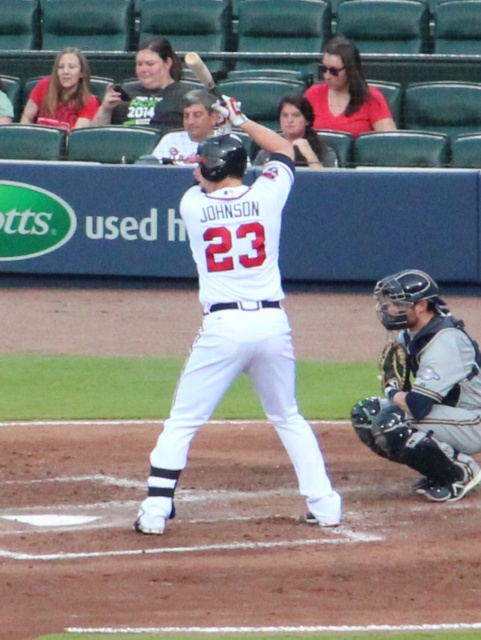
Is point (199, 99) less distant than point (379, 378)?

No.

Which is behind, point (226, 96) or point (390, 356)?

Positioned behind is point (226, 96).

Image resolution: width=481 pixels, height=640 pixels. Describe the element at coordinates (191, 128) in the screenshot. I see `smooth skin face at upper center` at that location.

Where is `smooth skin face at upper center`? The height and width of the screenshot is (640, 481). smooth skin face at upper center is located at coordinates (191, 128).

Can you confirm if white matte uniform at center is positioned to the left of leather textured glove at lower right?

Indeed, white matte uniform at center is positioned on the left side of leather textured glove at lower right.

Does white matte uniform at center come behind leather textured glove at lower right?

No, white matte uniform at center is in front of leather textured glove at lower right.

Is point (152, 452) closer to viewer compared to point (395, 376)?

Yes, it is in front of point (395, 376).

Identify the location of white matte uniform at center. The width and height of the screenshot is (481, 640). pos(238,317).

Locate an element on the screen. gray matte catcher at lower right is located at coordinates (425, 388).

Does gray matte catcher at lower right come behind wooden baseball bat at upper center?

Yes, gray matte catcher at lower right is behind wooden baseball bat at upper center.

Is point (384, 406) positioned behind point (188, 56)?

That is False.

Identify the location of gray matte catcher at lower right. This screenshot has height=640, width=481. coord(425,388).